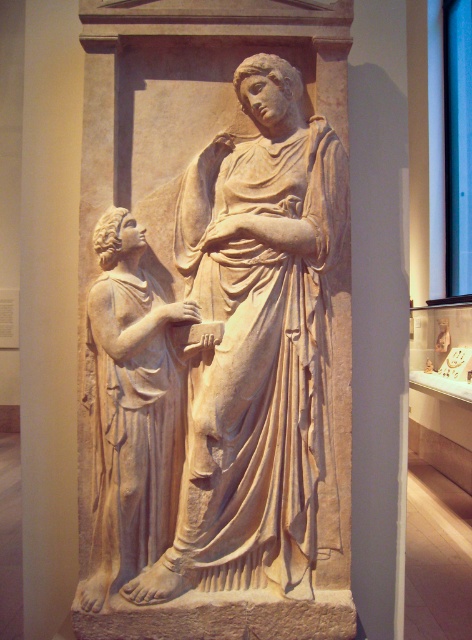
You are an art conservator examining the classical relief sculpture. You notice a specific point at coordinates (259, 348). Where exactly is this point located on the sculpture?

The point is located on the beige stone statue at center.

You are an archaeologist examining a classical relief sculpture. You notice the beige stone statue at center. Where is it located in the 2D coordinates of the relief?

The beige stone statue at center is located at the 2D coordinates point (259, 348).